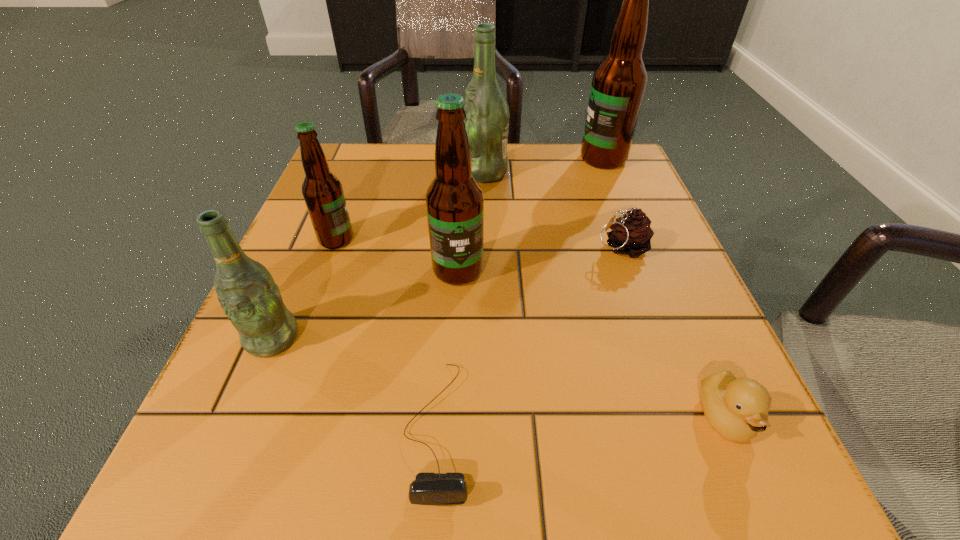
Identify the location of pinecone. The width and height of the screenshot is (960, 540). (631, 234).

This screenshot has width=960, height=540. Identify the location of duckling. (737, 409).

Identify the location of webcam. The image size is (960, 540). (432, 489).

Identify the location of vacant space located 0.370m on the label of the tallest object. This screenshot has width=960, height=540. (422, 159).

I want to click on free region located on the label of the tallest object, so click(554, 159).

Locate an element on the screen. This screenshot has width=960, height=540. free space located 0.390m on the label of the tallest object is located at coordinates (414, 159).

Find the location of a particular element. The image size is (960, 540). blank area located 0.060m on the surface of the bigger green beer bottle is located at coordinates (434, 172).

At what (x,y) coordinates should I click in order to perform the action: click on vacant space located 0.120m on the surface of the bigger green beer bottle. Please return your answer as a coordinate pair (x, y). This screenshot has width=960, height=540. Looking at the image, I should click on (408, 172).

The height and width of the screenshot is (540, 960). I want to click on free space located on the surface of the bigger green beer bottle, so click(430, 172).

Image resolution: width=960 pixels, height=540 pixels. I want to click on vacant region located on the label of the second biggest brown beer bottle, so click(x=450, y=423).